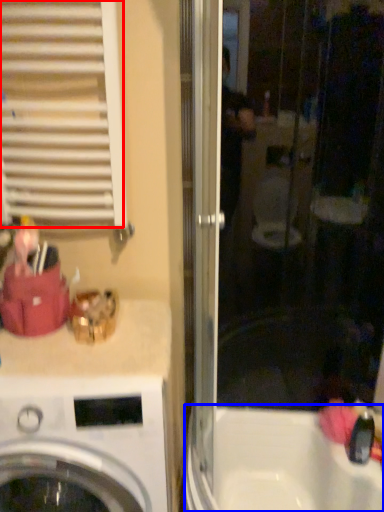
Question: Among these objects, which one is nearest to the camera, shutter (highlighted by a red box) or bath (highlighted by a blue box)?

Choices:
 (A) shutter
 (B) bath

Answer: (A)